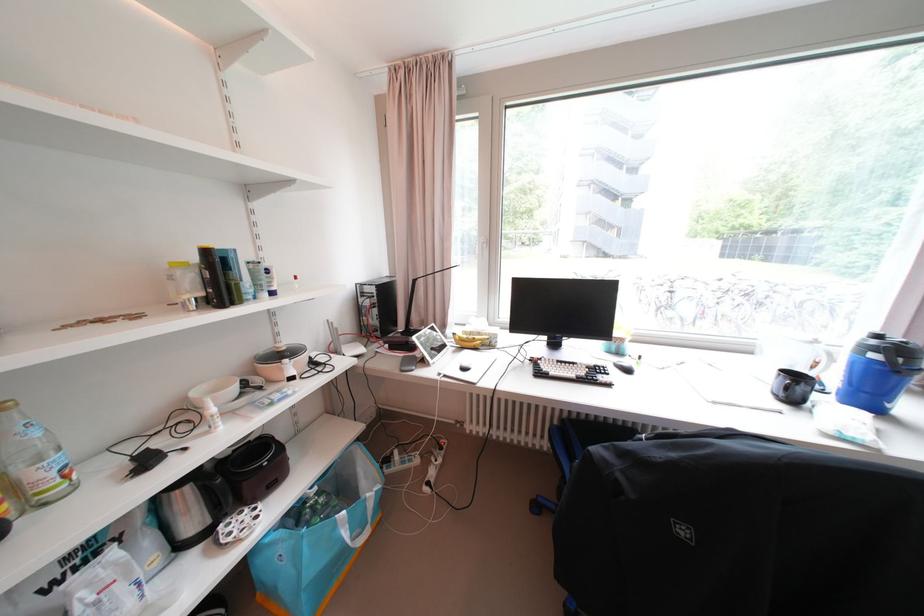
In order to click on white bowl in this screenshot , I will do `click(214, 392)`.